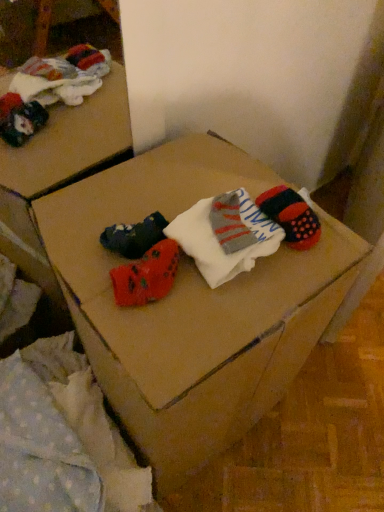
Where is `vacant space to the right of cardboard box at center`? vacant space to the right of cardboard box at center is located at coordinates (327, 431).